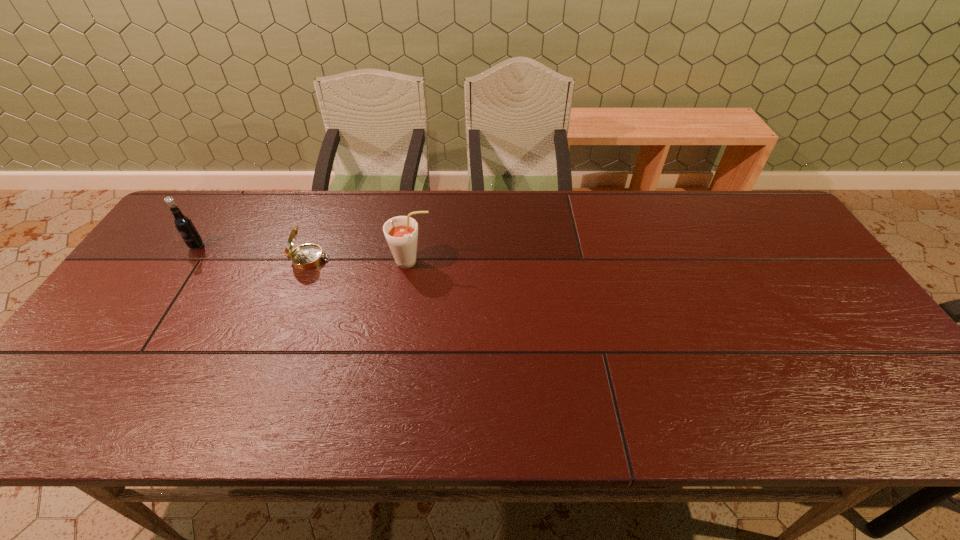
This screenshot has height=540, width=960. In the image, there is a desktop. Identify the location of free space at the far edge. (344, 208).

The width and height of the screenshot is (960, 540). In order to click on vacant space at the near edge of the desktop in this screenshot , I will do `click(828, 411)`.

Where is `vacant area at the right edge of the desktop`? This screenshot has height=540, width=960. vacant area at the right edge of the desktop is located at coordinates (832, 347).

Locate an element on the screen. This screenshot has height=540, width=960. blank space at the far left corner of the desktop is located at coordinates (199, 205).

At what (x,y) coordinates should I click in order to perform the action: click on free space at the near left corner of the desktop. Please return your answer as a coordinate pair (x, y). Looking at the image, I should click on (104, 393).

This screenshot has height=540, width=960. In the image, there is a desktop. Identify the location of vacant region at the far right corner. (743, 220).

At what (x,y) coordinates should I click in order to perform the action: click on free space between the shortest object and the rightmost object. Please return your answer as a coordinate pair (x, y). Looking at the image, I should click on (361, 261).

Locate an element on the screen. The width and height of the screenshot is (960, 540). blank region between the rightmost object and the compass is located at coordinates (361, 261).

In order to click on free space between the right root beer and the second object from left to right in this screenshot , I will do `click(361, 261)`.

The width and height of the screenshot is (960, 540). I want to click on free space between the compass and the rightmost object, so click(x=361, y=261).